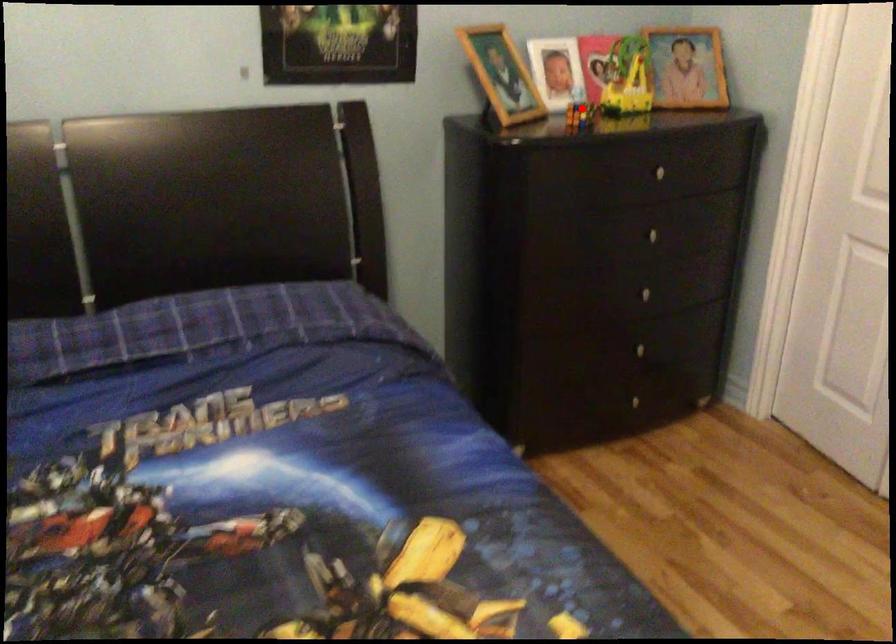
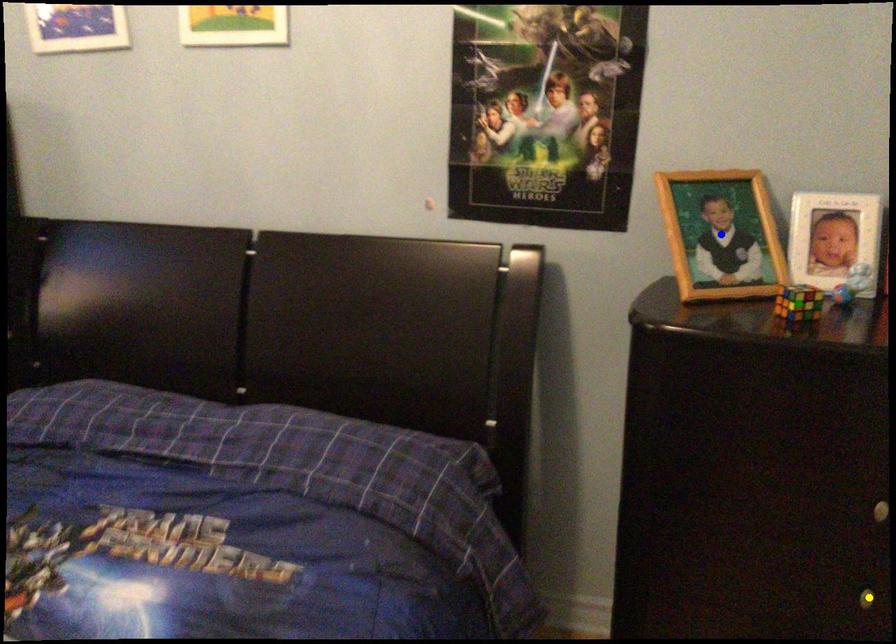
Question: I am providing you with two images of the same scene from different viewpoints. A red point is marked on the first image. You are given multiple points on the second image. Can you choose the point in image 2 that corresponds to the point in image 1?

Choices:
 (A) green point
 (B) blue point
 (C) yellow point

Answer: (A)